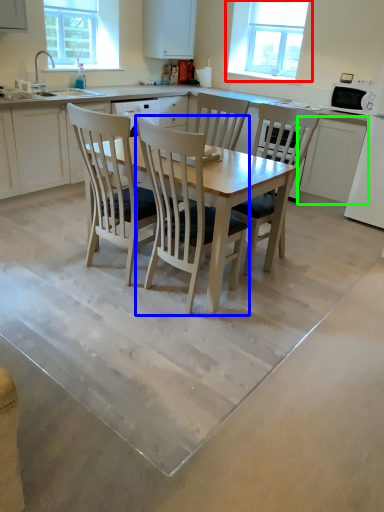
Question: Which object is positioned closest to window (highlighted by a red box)? Select from chair (highlighted by a blue box) and cabinetry (highlighted by a green box).

Choices:
 (A) chair
 (B) cabinetry

Answer: (B)